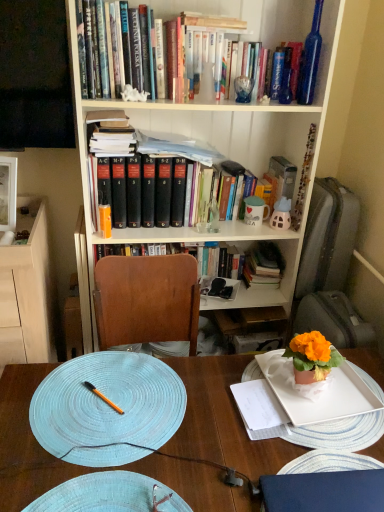
The height and width of the screenshot is (512, 384). What are the coordinates of `vacant space to the right of orange glossy pen at center` in the screenshot? It's located at (168, 405).